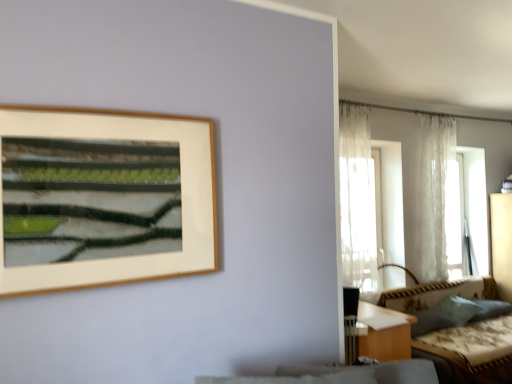
Question: Does white sheer curtain at upper right, the 1th curtain in the back-to-front sequence, contain translucent fabric window at right?

Choices:
 (A) no
 (B) yes

Answer: (A)

Question: Is white sheer curtain at upper right, the second curtain when ordered from left to right, positioned beyond the bounds of translucent fabric window at right?

Choices:
 (A) yes
 (B) no

Answer: (A)

Question: Can you confirm if white sheer curtain at upper right, the 1th curtain positioned from the right, is bigger than translucent fabric window at right?

Choices:
 (A) yes
 (B) no

Answer: (B)

Question: Is the position of white sheer curtain at upper right, the 1th curtain in the back-to-front sequence, more distant than that of translucent fabric window at right?

Choices:
 (A) yes
 (B) no

Answer: (B)

Question: From a real-world perspective, does white sheer curtain at upper right, the second curtain when ordered from left to right, stand above translucent fabric window at right?

Choices:
 (A) no
 (B) yes

Answer: (B)

Question: Based on their sizes in the image, would you say white sheer curtain at upper right, the 1th curtain positioned from the right, is bigger or smaller than sheer white curtain at right, placed as the second curtain when sorted from right to left?

Choices:
 (A) big
 (B) small

Answer: (B)

Question: Considering the positions of white sheer curtain at upper right, the 1th curtain in the back-to-front sequence, and sheer white curtain at right, which is counted as the first curtain, starting from the front, in the image, is white sheer curtain at upper right, the 1th curtain in the back-to-front sequence, wider or thinner than sheer white curtain at right, which is counted as the first curtain, starting from the front,?

Choices:
 (A) thin
 (B) wide

Answer: (A)

Question: Is white sheer curtain at upper right, which is the second curtain in front-to-back order, situated inside sheer white curtain at right, placed as the second curtain when sorted from right to left, or outside?

Choices:
 (A) inside
 (B) outside

Answer: (B)

Question: Considering their positions, is white sheer curtain at upper right, the second curtain when ordered from left to right, located in front of or behind sheer white curtain at right, placed as the second curtain when sorted from right to left?

Choices:
 (A) behind
 (B) front

Answer: (A)

Question: In terms of height, does white sheer curtain at upper right, which is the second curtain in front-to-back order, look taller or shorter compared to green fabric pillow at lower right?

Choices:
 (A) short
 (B) tall

Answer: (B)

Question: Is white sheer curtain at upper right, the second curtain when ordered from left to right, in front of or behind green fabric pillow at lower right in the image?

Choices:
 (A) behind
 (B) front

Answer: (A)

Question: Which is correct: white sheer curtain at upper right, the second curtain when ordered from left to right, is inside green fabric pillow at lower right, or outside of it?

Choices:
 (A) inside
 (B) outside

Answer: (B)

Question: Considering the positions of white sheer curtain at upper right, the 1th curtain in the back-to-front sequence, and green fabric pillow at lower right in the image, is white sheer curtain at upper right, the 1th curtain in the back-to-front sequence, bigger or smaller than green fabric pillow at lower right?

Choices:
 (A) small
 (B) big

Answer: (B)

Question: Looking at their shapes, would you say textured beige couch at lower right is wider or thinner than translucent fabric window at right?

Choices:
 (A) wide
 (B) thin

Answer: (A)

Question: Would you say textured beige couch at lower right is to the left or to the right of translucent fabric window at right in the picture?

Choices:
 (A) left
 (B) right

Answer: (A)